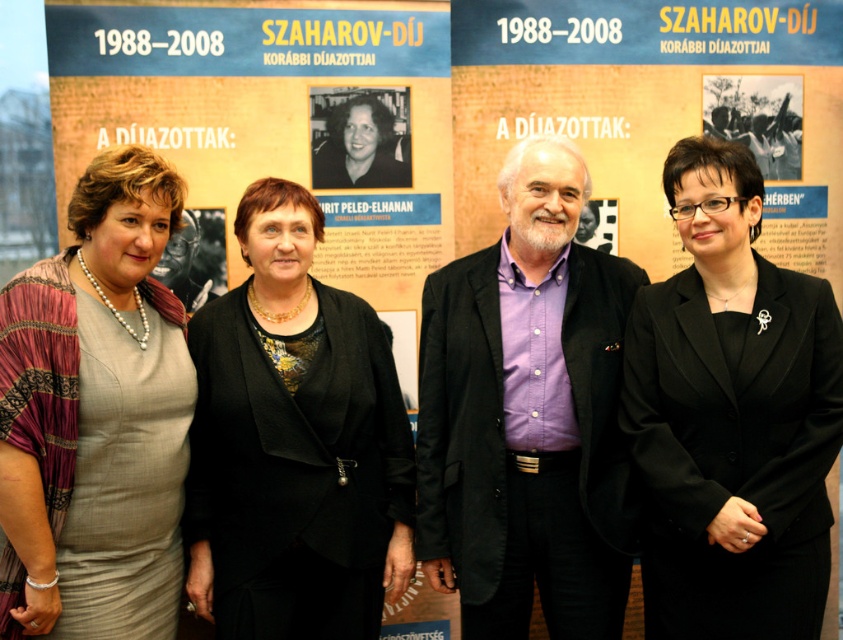
Question: Does black glossy blazer at center appear on the right side of matte gray dress at center left?

Choices:
 (A) yes
 (B) no

Answer: (A)

Question: Is purple cotton shirt at center positioned at the back of matte gray dress at center left?

Choices:
 (A) no
 (B) yes

Answer: (B)

Question: Is black textured blazer at center above matte gray dress at center left?

Choices:
 (A) yes
 (B) no

Answer: (B)

Question: Which of the following is the closest to the observer?

Choices:
 (A) (262, 458)
 (B) (527, 568)
 (C) (79, 524)
 (D) (710, 349)

Answer: (C)

Question: Which object appears closest to the camera in this image?

Choices:
 (A) black glossy blazer at center
 (B) black textured blazer at center
 (C) purple cotton shirt at center
 (D) matte gray dress at center left

Answer: (D)

Question: Which point is closer to the camera?

Choices:
 (A) matte gray dress at center left
 (B) purple cotton shirt at center
 (C) black textured blazer at center
 (D) black glossy blazer at center

Answer: (A)